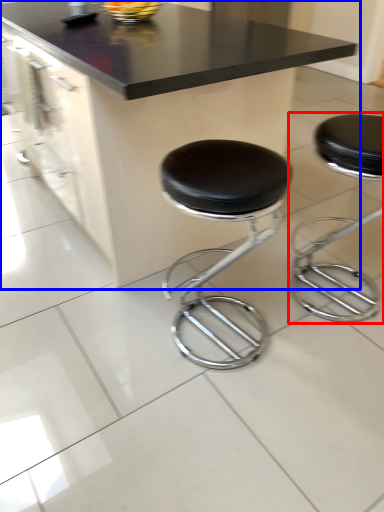
Question: Which of the following is the closest to the observer, stool (highlighted by a red box) or table (highlighted by a blue box)?

Choices:
 (A) stool
 (B) table

Answer: (B)